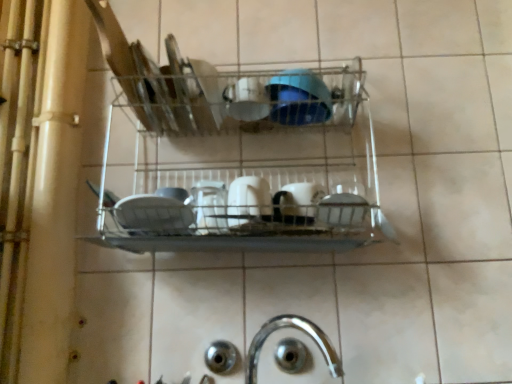
Question: Can you confirm if blue glossy bowl at center, the first tableware when ordered from top to bottom, is thinner than white glossy cup at upper center, which is the second tableware from top to bottom?

Choices:
 (A) no
 (B) yes

Answer: (A)

Question: Is blue glossy bowl at center, the first tableware when ordered from top to bottom, outside of white glossy cup at upper center, acting as the third tableware starting from the bottom?

Choices:
 (A) yes
 (B) no

Answer: (A)

Question: Is white glossy cup at upper center, which is the second tableware from top to bottom, located within blue glossy bowl at center, the first tableware when ordered from top to bottom?

Choices:
 (A) yes
 (B) no

Answer: (B)

Question: From a real-world perspective, is blue glossy bowl at center, the first tableware when ordered from top to bottom, below white glossy cup at upper center, which is the second tableware from top to bottom?

Choices:
 (A) no
 (B) yes

Answer: (A)

Question: From the image's perspective, is blue glossy bowl at center, which appears as the fourth tableware when ordered from the bottom, on top of white glossy cup at upper center, acting as the third tableware starting from the bottom?

Choices:
 (A) yes
 (B) no

Answer: (A)

Question: Considering the relative positions of blue glossy bowl at center, which appears as the fourth tableware when ordered from the bottom, and white glossy cup at upper center, acting as the third tableware starting from the bottom, in the image provided, is blue glossy bowl at center, which appears as the fourth tableware when ordered from the bottom, to the left of white glossy cup at upper center, acting as the third tableware starting from the bottom, from the viewer's perspective?

Choices:
 (A) yes
 (B) no

Answer: (B)

Question: Is blue glossy bowl at center, which appears as the fourth tableware when ordered from the bottom, smaller than white glossy mug at center, the fourth tableware positioned from the top?

Choices:
 (A) no
 (B) yes

Answer: (A)

Question: Is blue glossy bowl at center, which appears as the fourth tableware when ordered from the bottom, outside white glossy mug at center, the fourth tableware positioned from the top?

Choices:
 (A) yes
 (B) no

Answer: (A)

Question: From a real-world perspective, is blue glossy bowl at center, which appears as the fourth tableware when ordered from the bottom, physically below white glossy mug at center, the 1th tableware positioned from the bottom?

Choices:
 (A) no
 (B) yes

Answer: (A)

Question: Considering the relative sizes of blue glossy bowl at center, the first tableware when ordered from top to bottom, and white glossy mug at center, the fourth tableware positioned from the top, in the image provided, is blue glossy bowl at center, the first tableware when ordered from top to bottom, shorter than white glossy mug at center, the fourth tableware positioned from the top,?

Choices:
 (A) no
 (B) yes

Answer: (B)

Question: Is blue glossy bowl at center, the first tableware when ordered from top to bottom, oriented towards white glossy mug at center, the 1th tableware positioned from the bottom?

Choices:
 (A) yes
 (B) no

Answer: (B)

Question: Is blue glossy bowl at center, the first tableware when ordered from top to bottom, touching white glossy mug at center, the fourth tableware positioned from the top?

Choices:
 (A) no
 (B) yes

Answer: (A)

Question: Can you confirm if metallic wire rack at center is taller than white glossy mug at center, the 1th tableware positioned from the bottom?

Choices:
 (A) no
 (B) yes

Answer: (B)